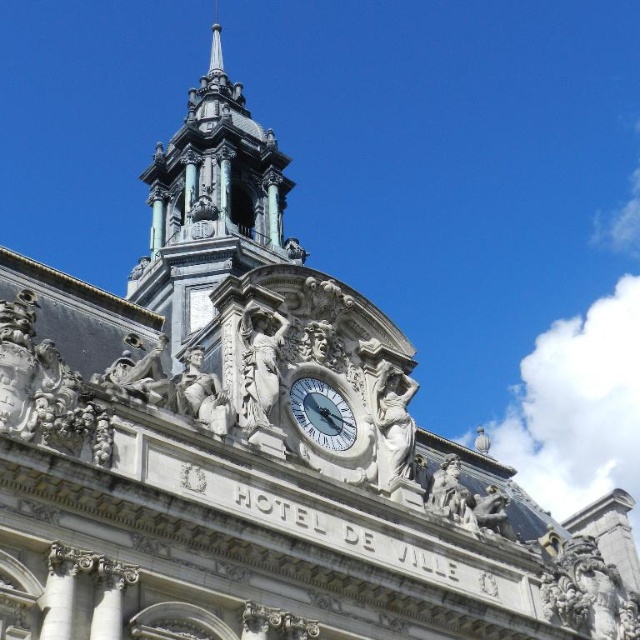
Measure the distance between polished bronze spire at upper center and camera.

170.61 feet

Where is `polished bronze spire at upper center`? polished bronze spire at upper center is located at coordinates (211, 205).

I want to click on polished bronze spire at upper center, so [211, 205].